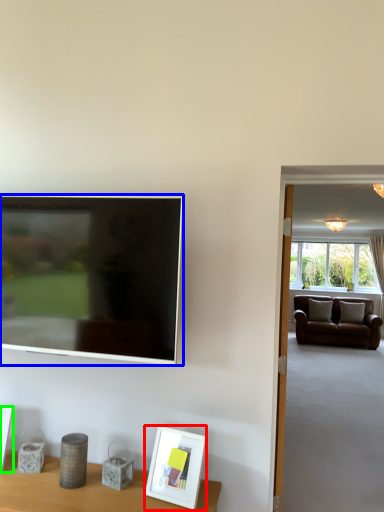
Question: Based on their relative distances, which object is nearer to picture frame (highlighted by a red box)? Choose from television (highlighted by a blue box) and picture frame (highlighted by a green box).

Choices:
 (A) television
 (B) picture frame

Answer: (A)